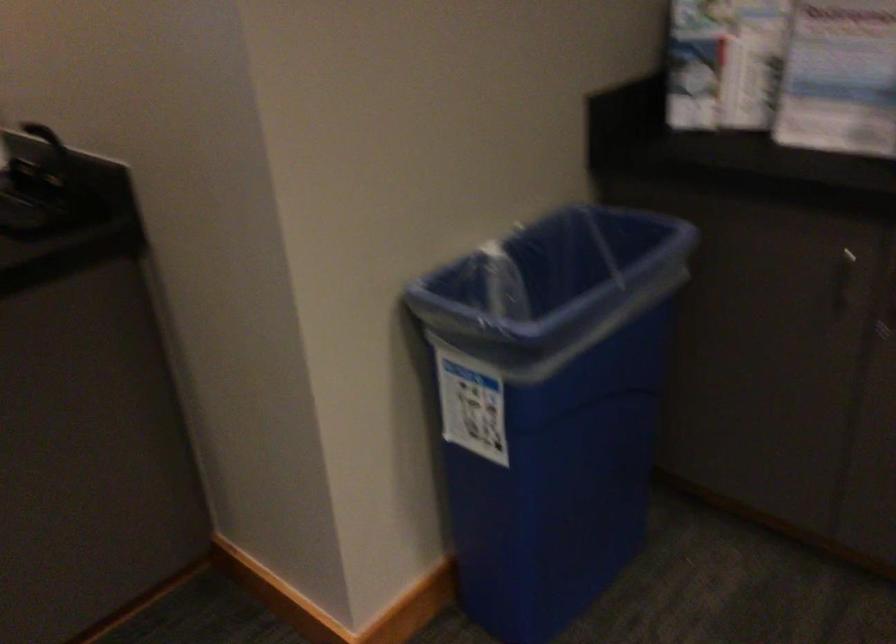
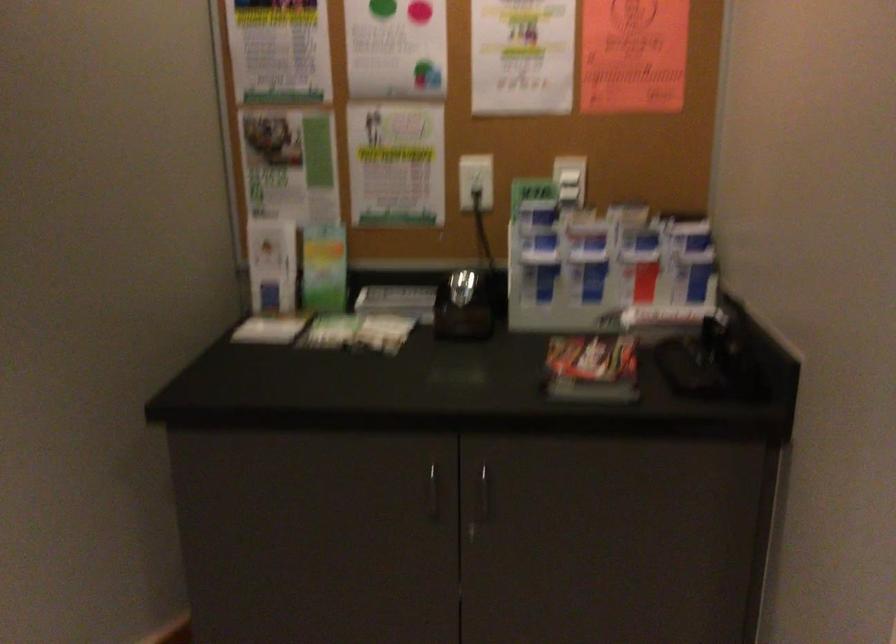
Question: How did the camera likely rotate?

Choices:
 (A) Left
 (B) Right
 (C) Up
 (D) Down

Answer: (A)